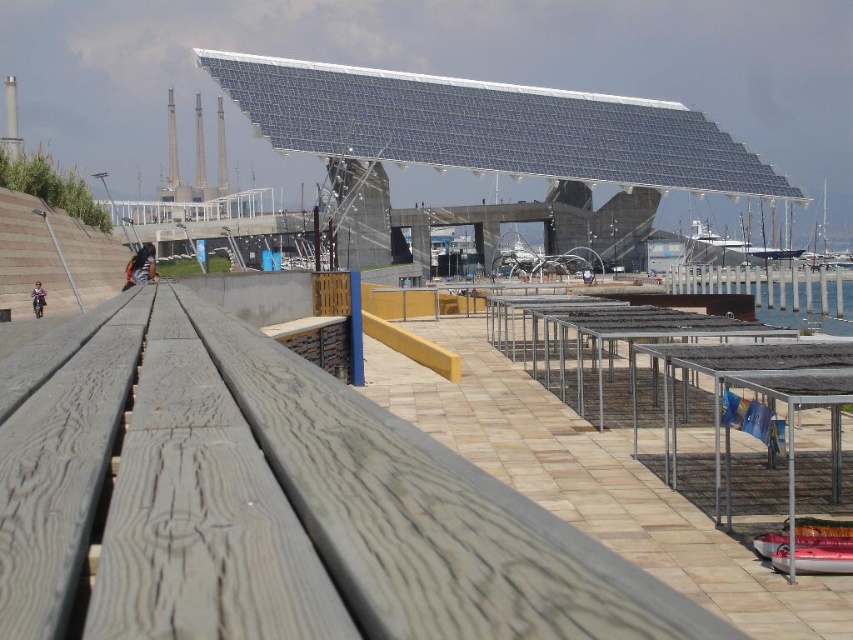
Question: Among these points, which one is farthest from the camera?

Choices:
 (A) (366, 618)
 (B) (849, 310)

Answer: (B)

Question: Where is weathered wood dock at center located in relation to clear water at lower right in the image?

Choices:
 (A) right
 (B) left

Answer: (B)

Question: Considering the relative positions of weathered wood dock at center and clear water at lower right in the image provided, where is weathered wood dock at center located with respect to clear water at lower right?

Choices:
 (A) below
 (B) above

Answer: (A)

Question: Which point is closer to the camera?

Choices:
 (A) clear water at lower right
 (B) weathered wood dock at center

Answer: (B)

Question: Which point appears closest to the camera in this image?

Choices:
 (A) (401, 525)
 (B) (788, 307)

Answer: (A)

Question: Does weathered wood dock at center have a greater width compared to clear water at lower right?

Choices:
 (A) yes
 (B) no

Answer: (B)